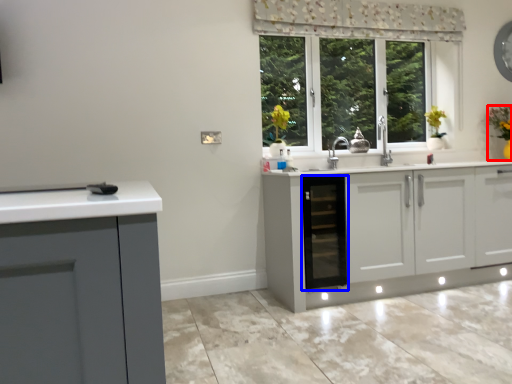
Question: Which point is further to the camera, houseplant (highlighted by a red box) or dish washer (highlighted by a blue box)?

Choices:
 (A) houseplant
 (B) dish washer

Answer: (A)